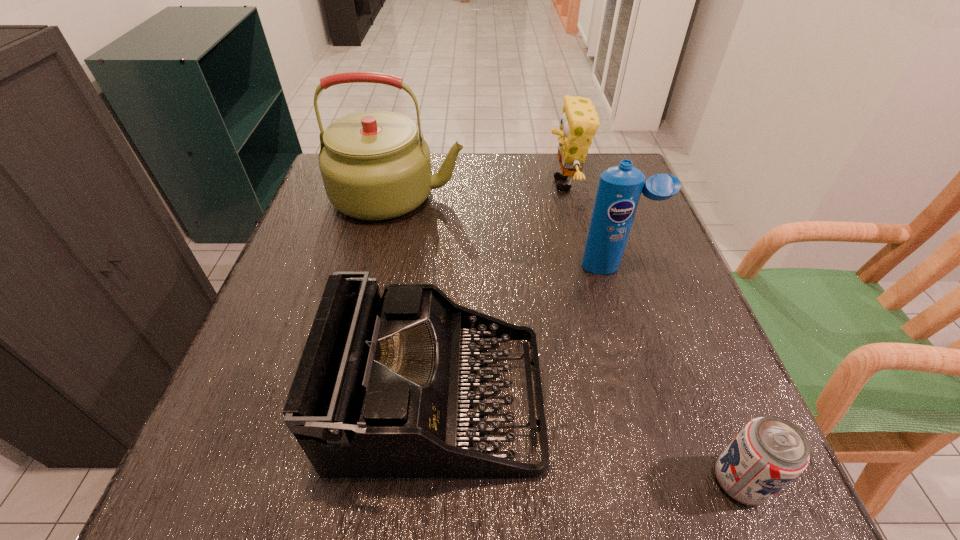
I want to click on free space located 0.210m on the face of the sponge, so click(466, 184).

The image size is (960, 540). In order to click on vacant point located on the typing side of the typewriter in this screenshot , I will do `click(596, 400)`.

This screenshot has width=960, height=540. Find the location of `free region located 0.310m on the left of the shortest object`. free region located 0.310m on the left of the shortest object is located at coordinates tap(496, 481).

You are a GUI agent. You are given a task and a screenshot of the screen. Output one action in this format:
    pyautogui.click(x=<x>, y=<y>)
    Task: Click on the kettle at the far edge
    
    Given the screenshot: What is the action you would take?
    pyautogui.click(x=374, y=165)

Image resolution: width=960 pixels, height=540 pixels. Find the location of `sponge located in the far edge section of the desktop`. sponge located in the far edge section of the desktop is located at coordinates (579, 122).

Where is `typewriter that is at the near edge`? typewriter that is at the near edge is located at coordinates (384, 385).

The height and width of the screenshot is (540, 960). What are the coordinates of `beer can that is at the near edge` in the screenshot? It's located at (769, 452).

At what (x,y) coordinates should I click in order to perform the action: click on object present at the left edge. Please return your answer as a coordinate pair (x, y). Looking at the image, I should click on (374, 165).

Where is `shampoo that is at the right edge`? Image resolution: width=960 pixels, height=540 pixels. shampoo that is at the right edge is located at coordinates (620, 187).

Identify the location of sponge that is at the right edge. The width and height of the screenshot is (960, 540). (579, 122).